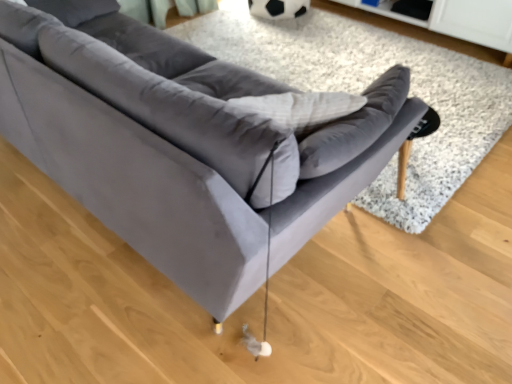
Question: From a real-world perspective, is velvet gray sofa at center located beneath velvet gray couch at center?

Choices:
 (A) yes
 (B) no

Answer: (A)

Question: Does velvet gray sofa at center have a greater height compared to velvet gray couch at center?

Choices:
 (A) no
 (B) yes

Answer: (A)

Question: Is velvet gray sofa at center next to velvet gray couch at center?

Choices:
 (A) yes
 (B) no

Answer: (B)

Question: Does velvet gray sofa at center have a lesser width compared to velvet gray couch at center?

Choices:
 (A) no
 (B) yes

Answer: (A)

Question: From the image's perspective, is velvet gray sofa at center located above velvet gray couch at center?

Choices:
 (A) yes
 (B) no

Answer: (A)

Question: Is velvet gray sofa at center not close to velvet gray couch at center?

Choices:
 (A) yes
 (B) no

Answer: (A)

Question: From the image's perspective, does velvet gray couch at center appear lower than velvet gray sofa at center?

Choices:
 (A) yes
 (B) no

Answer: (A)

Question: Does velvet gray couch at center have a lesser height compared to velvet gray sofa at center?

Choices:
 (A) yes
 (B) no

Answer: (B)

Question: Does velvet gray couch at center have a greater width compared to velvet gray sofa at center?

Choices:
 (A) yes
 (B) no

Answer: (B)

Question: Considering the relative sizes of velvet gray couch at center and velvet gray sofa at center in the image provided, is velvet gray couch at center bigger than velvet gray sofa at center?

Choices:
 (A) yes
 (B) no

Answer: (A)

Question: Does velvet gray couch at center have a smaller size compared to velvet gray sofa at center?

Choices:
 (A) yes
 (B) no

Answer: (B)

Question: From a real-world perspective, is velvet gray couch at center located beneath velvet gray sofa at center?

Choices:
 (A) no
 (B) yes

Answer: (A)

Question: Is velvet gray sofa at center inside the boundaries of velvet gray couch at center, or outside?

Choices:
 (A) outside
 (B) inside

Answer: (A)